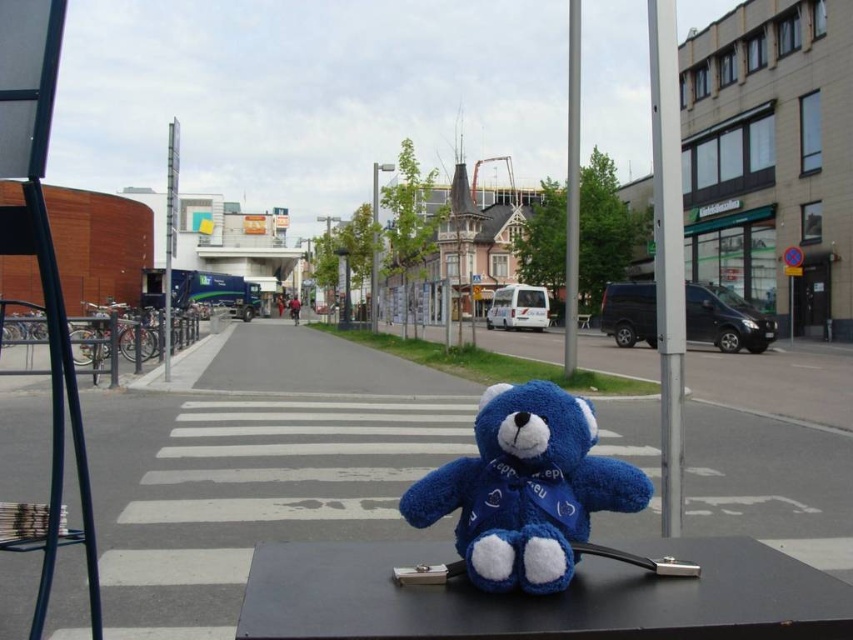
Between point (569, 333) and point (378, 170), which one is positioned behind?

Positioned behind is point (378, 170).

Does metallic silver pole at center appear under silver metallic pole at center?

No, metallic silver pole at center is not below silver metallic pole at center.

Find the location of a particular element. metallic silver pole at center is located at coordinates (572, 189).

Is point (682, 604) behind point (541, 385)?

No, (682, 604) is closer to viewer.

Which of these two, blue plush bear at center or velvety blue teddy bear at center, stands shorter?

Standing shorter between the two is blue plush bear at center.

Is point (585, 561) behind point (486, 573)?

Yes, it is behind point (486, 573).

I want to click on blue plush bear at center, so click(x=541, y=596).

Which is behind, point (569, 83) or point (173, 236)?

Positioned behind is point (569, 83).

Does metallic silver pole at center have a greater height compared to metallic pole at upper center?

No.

The width and height of the screenshot is (853, 640). I want to click on metallic silver pole at center, so click(572, 189).